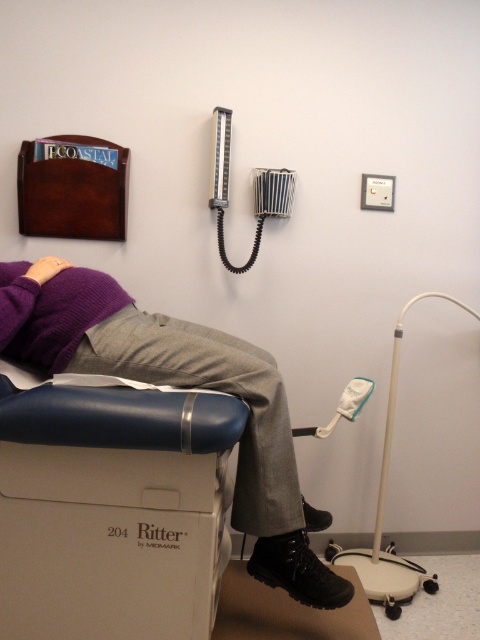
You are a nurse entering the room and need to locate the blood pressure cuff. Given the spatial relationship between the purple sweater at upper left and the striped fabric blood pressure cuff at upper center, which object is closer to the ceiling?

The purple sweater at upper left is much taller than the striped fabric blood pressure cuff at upper center, so the purple sweater at upper left is closer to the ceiling.

You are a patient in the medical examination room and need to adjust the light from the white plastic floor lamp at lower right. Based on its position, which direction should you move to reach it?

The white plastic floor lamp at lower right is located at point (383, 515), so you should move towards the lower right direction to reach it.